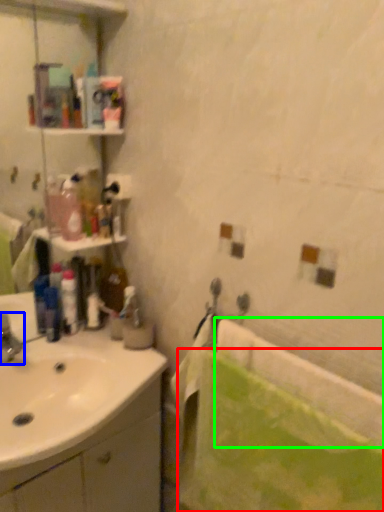
Question: Considering the real-world distances, which object is closest to bath towel (highlighted by a red box)? tap (highlighted by a blue box) or bath (highlighted by a green box).

Choices:
 (A) tap
 (B) bath

Answer: (B)